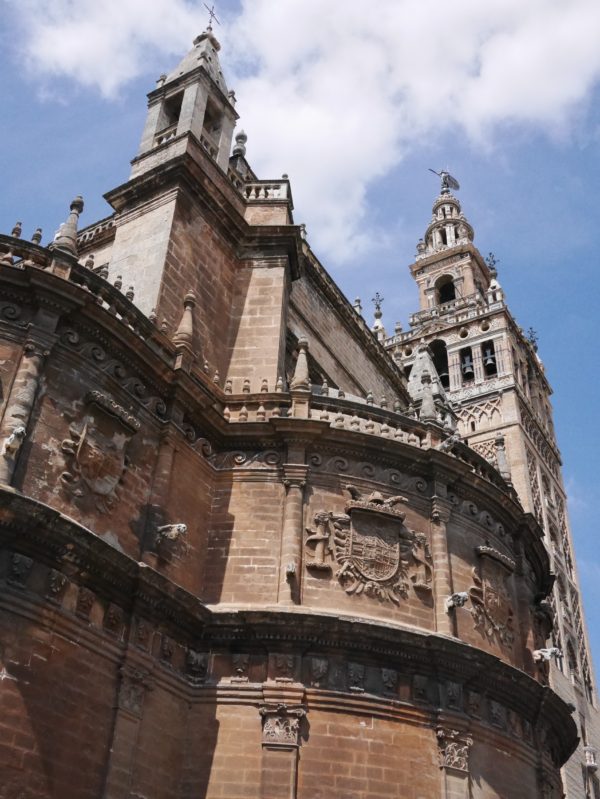
Where is `statues on the left`? statues on the left is located at coordinates (170, 538), (25, 431).